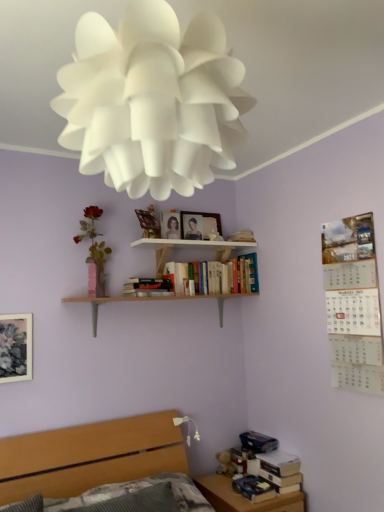
Question: From the image's perspective, is wooden bed at lower left located above or below wooden bookshelf at upper center, which appears as the second shelf when ordered from the bottom?

Choices:
 (A) above
 (B) below

Answer: (B)

Question: Looking at their shapes, would you say wooden bed at lower left is wider or thinner than wooden bookshelf at upper center, the 1th shelf when ordered from top to bottom?

Choices:
 (A) wide
 (B) thin

Answer: (A)

Question: Based on their relative distances, which object is farther from the white paper calendar at upper right?

Choices:
 (A) wooden bookshelf at upper center, the 1th shelf when ordered from top to bottom
 (B) matte pink vase at left, the 2th flower in the top-to-bottom sequence
 (C) light wood/roughobject at center, the first shelf from the bottom
 (D) matte wooden picture frame at upper center, which is the 3th picture frame from front to back
 (E) hardcover books at center, marked as the second book in a top-to-bottom arrangement

Answer: (B)

Question: Estimate the real-world distances between objects in this image. Which object is farther from the hardcover books at center, the 4th book in the bottom-to-top sequence?

Choices:
 (A) hardcover book at lower right, the fifth book viewed from the top
 (B) matte black tool at center, the third book positioned from the top
 (C) wooden table at lower right
 (D) white matte bookshelf at upper center, which is the 1th book from top to bottom
 (E) white paper flower at upper center, the 2th flower positioned from the back

Answer: (E)